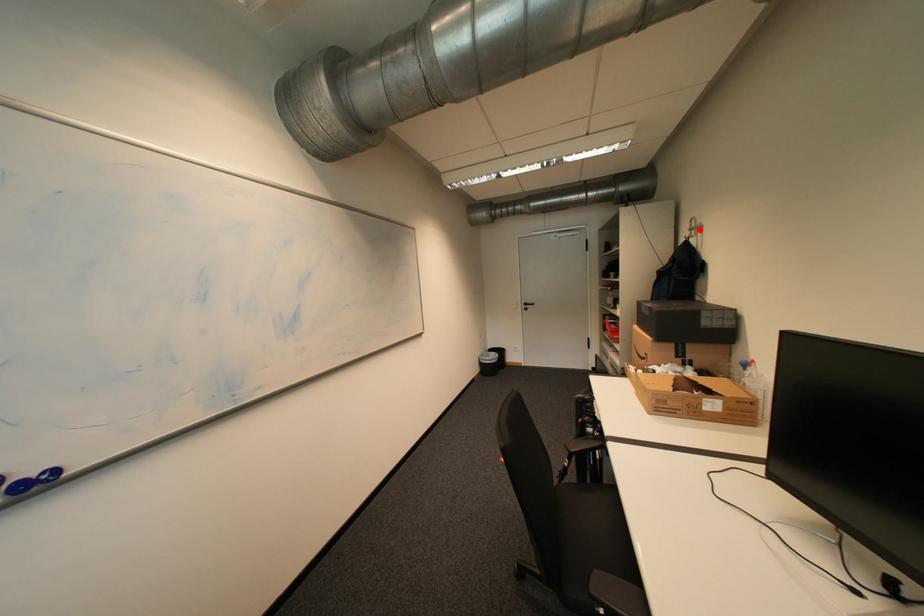
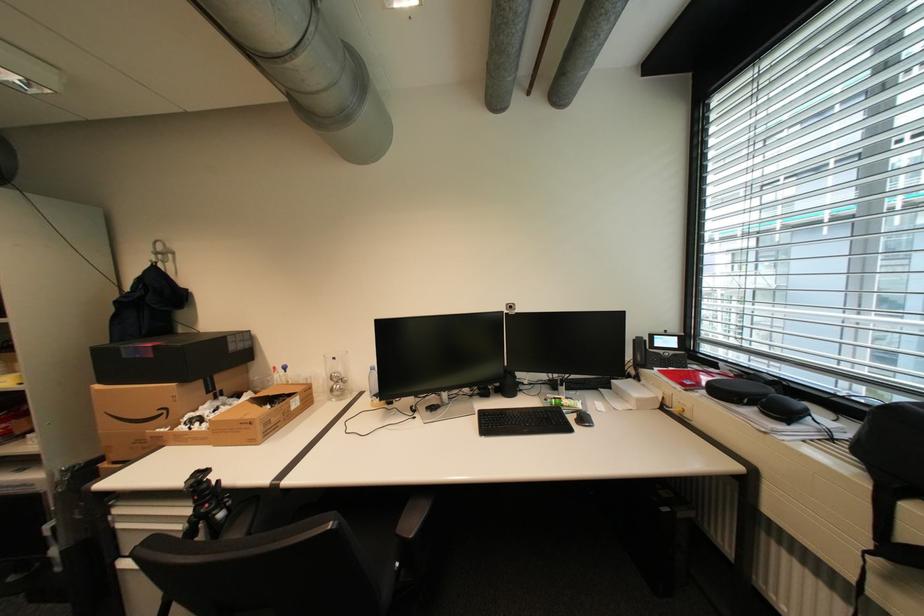
Where in the second image is the point corresponding to the highlighted location from the first image?

(165, 254)